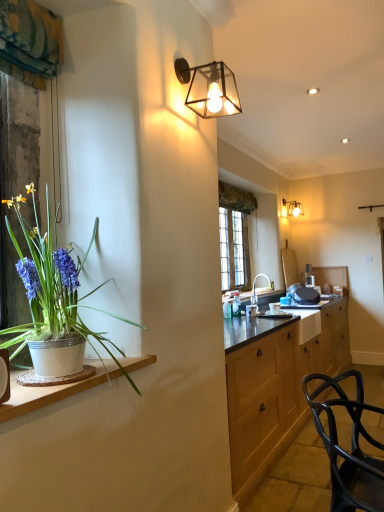
Describe the element at coordinates (291, 208) in the screenshot. I see `matte glass wall sconce at upper right, the 1th lamp from the right` at that location.

The image size is (384, 512). What do you see at coordinates (52, 391) in the screenshot?
I see `white ceramic pot at left` at bounding box center [52, 391].

Find the location of a particular element. white ceramic sink at center is located at coordinates (256, 296).

What are the coordinates of `matte glass wall sconce at upper right, the 1th lamp from the right` in the screenshot? It's located at (291, 208).

Can you confirm if white ceramic sink at center is positioned to the right of matte glass wall sconce at upper right, acting as the second lamp starting from the front?

In fact, white ceramic sink at center is to the left of matte glass wall sconce at upper right, acting as the second lamp starting from the front.

Who is smaller, white ceramic sink at center or matte glass wall sconce at upper right, the 1th lamp from the right?

matte glass wall sconce at upper right, the 1th lamp from the right.

From a real-world perspective, which is physically below, white ceramic sink at center or matte glass wall sconce at upper right, placed as the 1th lamp when sorted from back to front?

white ceramic sink at center is physically lower.

From the image's perspective, is matte glass lamp at upper center, the 2th lamp viewed from the right, on matte glass wall sconce at upper right, acting as the second lamp starting from the front?

Indeed, from the image's perspective, matte glass lamp at upper center, the 2th lamp viewed from the right, is shown above matte glass wall sconce at upper right, acting as the second lamp starting from the front.

Locate an element on the screen. This screenshot has height=512, width=384. lamp that is above the matte glass lamp at upper center, placed as the 1th lamp when sorted from front to back (from a real-world perspective) is located at coordinates (291, 208).

Can we say matte glass lamp at upper center, the 2th lamp viewed from the right, lies outside matte glass wall sconce at upper right, placed as the 1th lamp when sorted from back to front?

matte glass lamp at upper center, the 2th lamp viewed from the right, is positioned outside matte glass wall sconce at upper right, placed as the 1th lamp when sorted from back to front.

Considering the relative sizes of matte glass lamp at upper center, the 1th lamp from the left, and matte glass wall sconce at upper right, which is counted as the second lamp, starting from the left, in the image provided, is matte glass lamp at upper center, the 1th lamp from the left, shorter than matte glass wall sconce at upper right, which is counted as the second lamp, starting from the left,?

No.

Is matte glass lamp at upper center, the 1th lamp from the left, to the left or to the right of white ceramic sink at center in the image?

matte glass lamp at upper center, the 1th lamp from the left, is positioned on white ceramic sink at center's left side.

Image resolution: width=384 pixels, height=512 pixels. I want to click on lamp that is the 1st object above the white ceramic sink at center (from a real-world perspective), so click(209, 88).

In the scene shown: Considering the sizes of objects matte glass lamp at upper center, placed as the 2th lamp when sorted from back to front, and white ceramic sink at center in the image provided, who is wider, matte glass lamp at upper center, placed as the 2th lamp when sorted from back to front, or white ceramic sink at center?

white ceramic sink at center is wider.

Looking at this image, considering the sizes of objects matte glass lamp at upper center, the 1th lamp from the left, and white ceramic sink at center in the image provided, who is taller, matte glass lamp at upper center, the 1th lamp from the left, or white ceramic sink at center?

With more height is white ceramic sink at center.

Is white ceramic sink at center facing away from matte glass lamp at upper center, the 1th lamp from the left?

That's not correct — white ceramic sink at center is not looking away from matte glass lamp at upper center, the 1th lamp from the left.

Considering the positions of objects white ceramic sink at center and matte glass lamp at upper center, placed as the 2th lamp when sorted from back to front, in the image provided, who is more to the right, white ceramic sink at center or matte glass lamp at upper center, placed as the 2th lamp when sorted from back to front,?

white ceramic sink at center.

Does point (252, 309) come closer to viewer compared to point (210, 117)?

No.

Which is in front, white ceramic sink at center or matte glass lamp at upper center, the 1th lamp from the left?

matte glass lamp at upper center, the 1th lamp from the left.

I want to click on the 2nd lamp positioned above the white ceramic sink at center (from a real-world perspective), so click(x=291, y=208).

In the scene shown: Can you confirm if matte glass wall sconce at upper right, acting as the second lamp starting from the front, is positioned to the right of white ceramic sink at center?

Indeed, matte glass wall sconce at upper right, acting as the second lamp starting from the front, is positioned on the right side of white ceramic sink at center.

Which of these two, matte glass wall sconce at upper right, the 1th lamp from the right, or white ceramic sink at center, stands taller?

white ceramic sink at center.

How different are the orientations of matte glass wall sconce at upper right, acting as the second lamp starting from the front, and white ceramic sink at center in degrees?

There is a 0.475-degree angle between the facing directions of matte glass wall sconce at upper right, acting as the second lamp starting from the front, and white ceramic sink at center.

From a real-world perspective, which is physically above, white ceramic pot at left or white ceramic sink at center?

In real-world perspective, white ceramic sink at center is above.

Can you confirm if white ceramic pot at left is smaller than white ceramic sink at center?

Indeed, white ceramic pot at left has a smaller size compared to white ceramic sink at center.

Identify the location of countertop lying on the left of white ceramic sink at center. This screenshot has width=384, height=512. [x=52, y=391].

Considering the positions of objects white ceramic pot at left and white ceramic sink at center in the image provided, who is in front, white ceramic pot at left or white ceramic sink at center?

white ceramic pot at left is closer to the camera.

Is white ceramic pot at left oriented away from matte glass wall sconce at upper right, acting as the second lamp starting from the front?

white ceramic pot at left does not have its back to matte glass wall sconce at upper right, acting as the second lamp starting from the front.

Is white ceramic pot at left next to matte glass wall sconce at upper right, which is counted as the second lamp, starting from the left?

They are not placed beside each other.

From the image's perspective, which object appears higher, white ceramic pot at left or matte glass wall sconce at upper right, which is counted as the second lamp, starting from the left?

matte glass wall sconce at upper right, which is counted as the second lamp, starting from the left, appears higher in the image.

Is white ceramic pot at left bigger or smaller than matte glass wall sconce at upper right, the 1th lamp from the right?

Clearly, white ceramic pot at left is smaller in size than matte glass wall sconce at upper right, the 1th lamp from the right.

The height and width of the screenshot is (512, 384). Find the location of `lamp lying on the right of white ceramic sink at center`. lamp lying on the right of white ceramic sink at center is located at coordinates (291, 208).

Where is `lamp in front of the matte glass wall sconce at upper right, acting as the second lamp starting from the front`? lamp in front of the matte glass wall sconce at upper right, acting as the second lamp starting from the front is located at coordinates (209, 88).

Which object lies further to the anchor point white ceramic sink at center, white ceramic pot at left or matte glass lamp at upper center, the 2th lamp viewed from the right?

white ceramic pot at left.

Based on their spatial positions, is matte glass wall sconce at upper right, placed as the 1th lamp when sorted from back to front, or matte glass lamp at upper center, placed as the 1th lamp when sorted from front to back, further from white ceramic sink at center?

matte glass lamp at upper center, placed as the 1th lamp when sorted from front to back, is further to white ceramic sink at center.

Consider the image. From the image, which object appears to be farther from matte glass lamp at upper center, placed as the 2th lamp when sorted from back to front, matte glass wall sconce at upper right, the 1th lamp from the right, or white ceramic pot at left?

matte glass wall sconce at upper right, the 1th lamp from the right.

Considering their positions, is matte glass wall sconce at upper right, acting as the second lamp starting from the front, positioned closer to white ceramic pot at left than white ceramic sink at center?

Among the two, white ceramic sink at center is located nearer to white ceramic pot at left.

When comparing their distances from white ceramic sink at center, does matte glass wall sconce at upper right, which is counted as the second lamp, starting from the left, or white ceramic pot at left seem closer?

matte glass wall sconce at upper right, which is counted as the second lamp, starting from the left, lies closer to white ceramic sink at center than the other object.

Estimate the real-world distances between objects in this image. Which object is closer to matte glass wall sconce at upper right, which is counted as the second lamp, starting from the left, white ceramic pot at left or matte glass lamp at upper center, placed as the 2th lamp when sorted from back to front?

matte glass lamp at upper center, placed as the 2th lamp when sorted from back to front, is closer to matte glass wall sconce at upper right, which is counted as the second lamp, starting from the left.

When comparing their distances from white ceramic sink at center, does white ceramic pot at left or matte glass wall sconce at upper right, the 1th lamp from the right, seem further?

The object further to white ceramic sink at center is white ceramic pot at left.

Estimate the real-world distances between objects in this image. Which object is further from matte glass wall sconce at upper right, acting as the second lamp starting from the front, white ceramic pot at left or white ceramic sink at center?

white ceramic pot at left is positioned further to the anchor matte glass wall sconce at upper right, acting as the second lamp starting from the front.

Find the location of a particular element. lamp between white ceramic pot at left and white ceramic sink at center from front to back is located at coordinates (209, 88).

At what (x,y) coordinates should I click in order to perform the action: click on sink between white ceramic pot at left and matte glass wall sconce at upper right, which is counted as the second lamp, starting from the left, from front to back. Please return your answer as a coordinate pair (x, y). The height and width of the screenshot is (512, 384). Looking at the image, I should click on (256, 296).

Where is `sink positioned between matte glass lamp at upper center, the 1th lamp from the left, and matte glass wall sconce at upper right, the 1th lamp from the right, from near to far`? sink positioned between matte glass lamp at upper center, the 1th lamp from the left, and matte glass wall sconce at upper right, the 1th lamp from the right, from near to far is located at coordinates (256, 296).

Find the location of a particular element. lamp between white ceramic pot at left and matte glass wall sconce at upper right, which is counted as the second lamp, starting from the left, in the front-back direction is located at coordinates (209, 88).